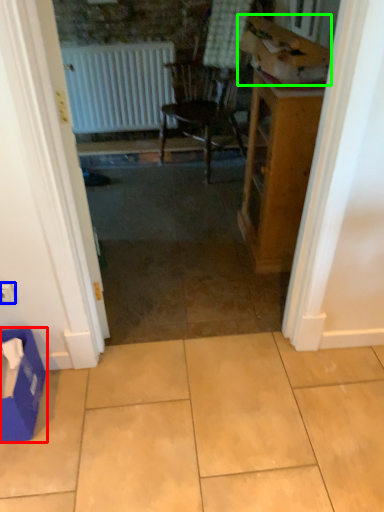
Question: Which object is positioned closest to cardboard box (highlighted by a red box)? Select from electric outlet (highlighted by a blue box) and cardboard box (highlighted by a green box).

Choices:
 (A) electric outlet
 (B) cardboard box

Answer: (A)